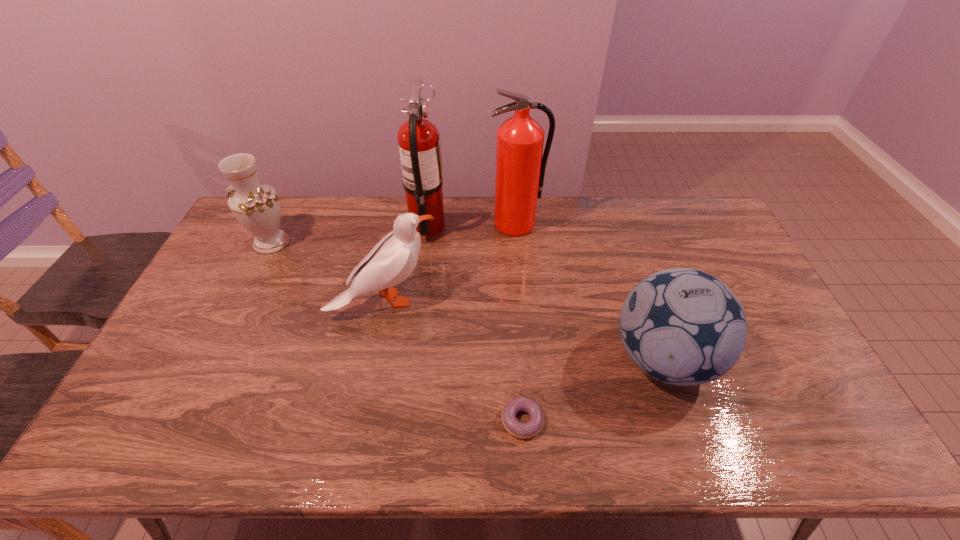
Where is `free space between the left fire extinguisher and the leftmost object`? free space between the left fire extinguisher and the leftmost object is located at coordinates (349, 234).

I want to click on free point between the rightmost object and the vase, so click(468, 301).

Where is `empty location between the shortest object and the left fire extinguisher`? empty location between the shortest object and the left fire extinguisher is located at coordinates (475, 323).

You are a GUI agent. You are given a task and a screenshot of the screen. Output one action in this format:
    pyautogui.click(x=<x>, y=<y>)
    Task: Click on the empty location between the gull and the right fire extinguisher
    Image resolution: width=960 pixels, height=540 pixels.
    Given the screenshot: What is the action you would take?
    pyautogui.click(x=450, y=262)

Identify which object is located as the fourth nearest to the left fire extinguisher. Please provide its 2D coordinates. Your answer should be formatted as a tuple, i.e. [(x, y)], where the tuple contains the x and y coordinates of a point satisfying the conditions above.

[(681, 326)]

Locate which object ranks third in proximity to the rightmost object. Please provide its 2D coordinates. Your answer should be formatted as a tuple, i.e. [(x, y)], where the tuple contains the x and y coordinates of a point satisfying the conditions above.

[(393, 259)]

Locate an element on the screen. This screenshot has height=540, width=960. free region that satisfies the following two spatial constraints: 1. at the nozzle of the right fire extinguisher; 2. at the beak of the gull is located at coordinates (523, 300).